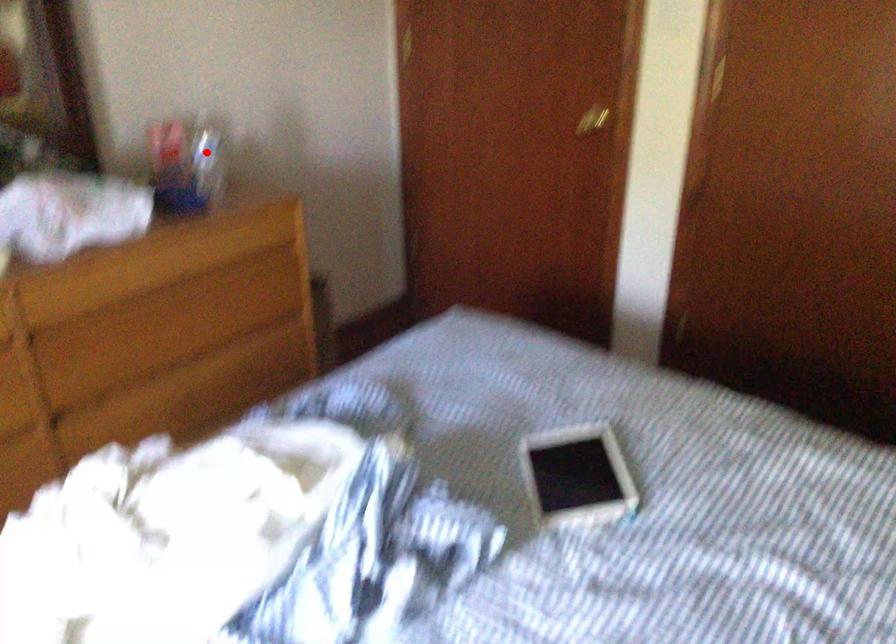
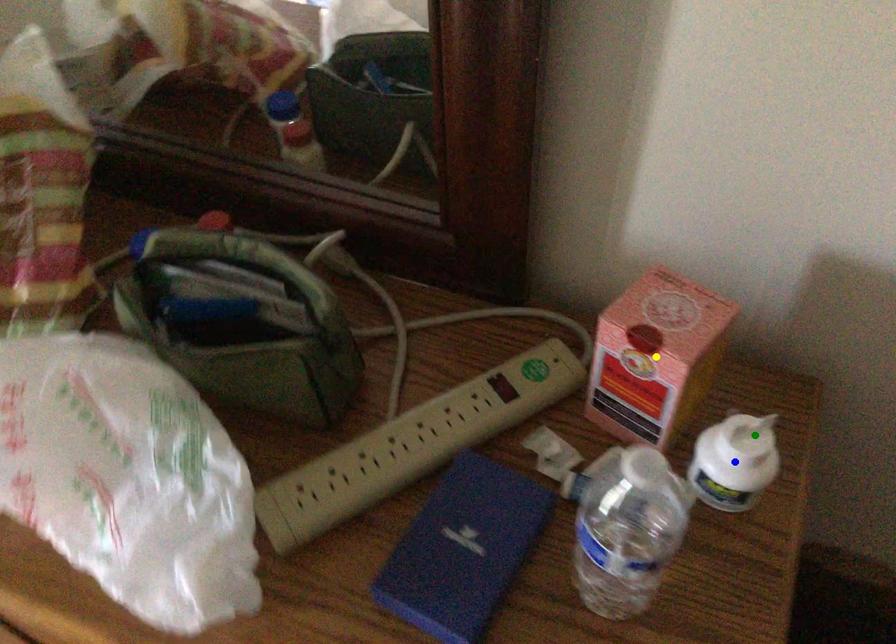
Question: I am providing you with two images of the same scene from different viewpoints. A red point is marked on the first image. You are given multiple points on the second image. Which point in image 2 is actually the same real-world point as the red point in image 1?

Choices:
 (A) yellow point
 (B) blue point
 (C) green point

Answer: (C)